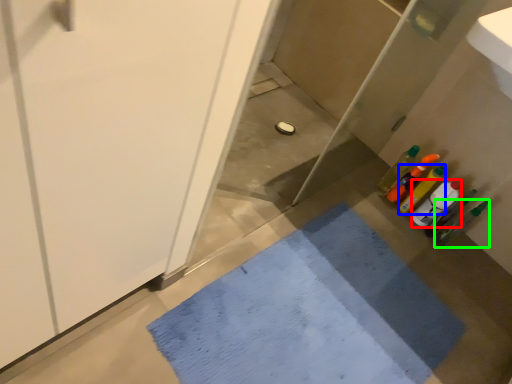
Question: Based on their relative distances, which object is nearer to bottle (highlighted by a red box)? Choose from bottle (highlighted by a blue box) and bottle (highlighted by a green box).

Choices:
 (A) bottle
 (B) bottle

Answer: (A)